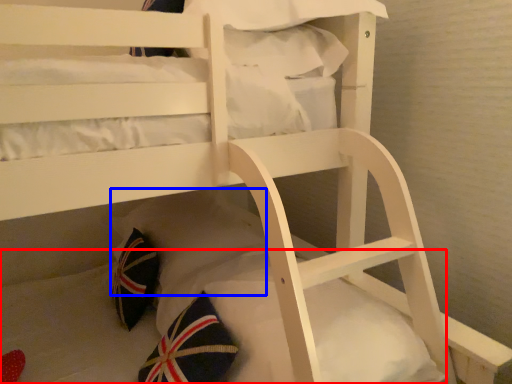
Question: Which object is further to the camera taking this photo, mattress (highlighted by a red box) or pillow (highlighted by a blue box)?

Choices:
 (A) mattress
 (B) pillow

Answer: (B)